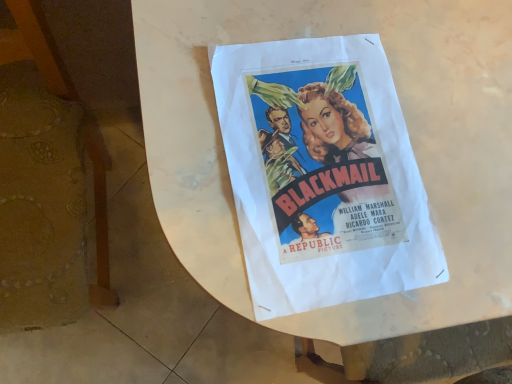
Where is `vacant space behind matte paper poster at center`? vacant space behind matte paper poster at center is located at coordinates (421, 58).